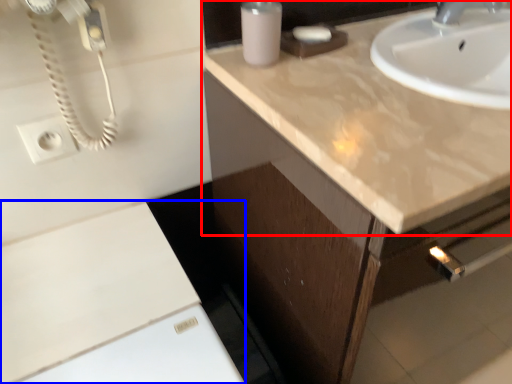
Question: Which of the following is the closest to the observer, countertop (highlighted by a red box) or cabinetry (highlighted by a blue box)?

Choices:
 (A) countertop
 (B) cabinetry

Answer: (A)